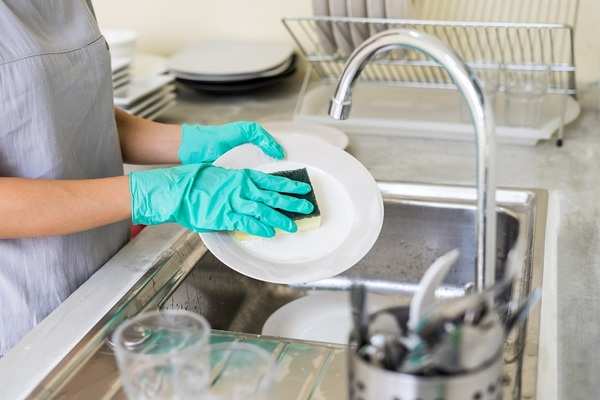
The height and width of the screenshot is (400, 600). I want to click on sink faucet, so click(417, 40).